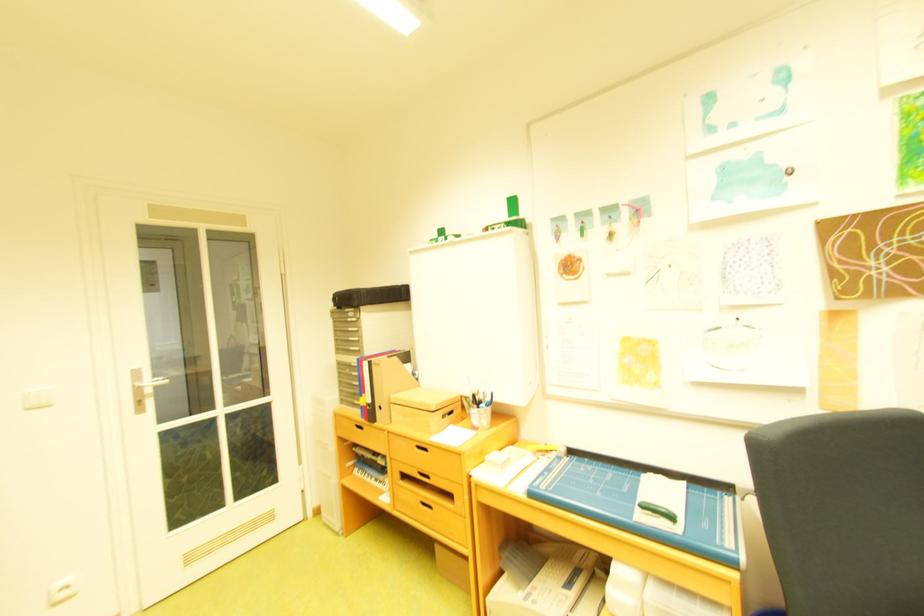
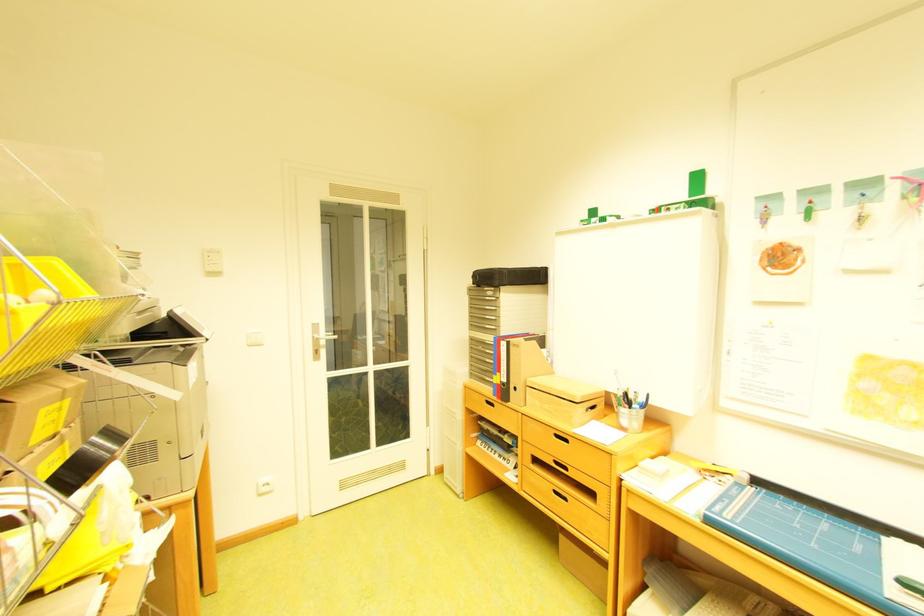
Where in the second image is the point corresponding to [368,293] from the first image?

(511, 272)